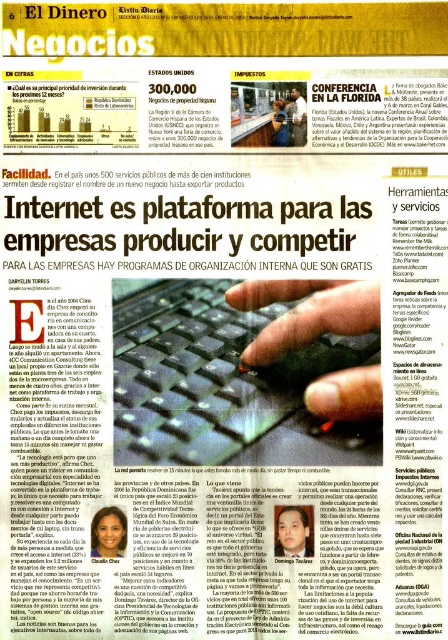
Is black matte keyboard at center below matte black pen at center?

Indeed, black matte keyboard at center is positioned under matte black pen at center.

Which is more to the right, black matte keyboard at center or matte black pen at center?

black matte keyboard at center

Measure the distance between point (267, 301) and camera.

Point (267, 301) and camera are 93.97 centimeters apart.

The width and height of the screenshot is (448, 640). What are the coordinates of `black matte keyboard at center` in the screenshot? It's located at (305, 312).

Can you confirm if dark skin face at center is shorter than matte black face at center?

Indeed, dark skin face at center has a lesser height compared to matte black face at center.

Does dark skin face at center have a greater width compared to matte black face at center?

Indeed, dark skin face at center has a greater width compared to matte black face at center.

The height and width of the screenshot is (640, 448). Find the location of `dark skin face at center`. dark skin face at center is located at coordinates (292, 532).

Locate an element on the screen. Image resolution: width=448 pixels, height=640 pixels. dark skin face at center is located at coordinates (292, 532).

Between black plastic keyboard at center and matte black face at center, which one is positioned lower?

matte black face at center is lower down.

Which is more to the left, black plastic keyboard at center or matte black face at center?

From the viewer's perspective, matte black face at center appears more on the left side.

The image size is (448, 640). Describe the element at coordinates (222, 385) in the screenshot. I see `black plastic keyboard at center` at that location.

Where is `black plastic keyboard at center`? This screenshot has width=448, height=640. black plastic keyboard at center is located at coordinates (222, 385).